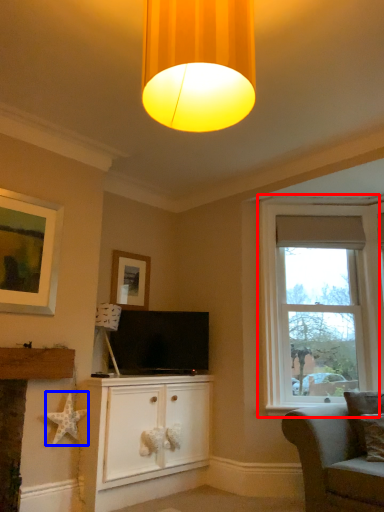
Question: Which object is closer to the camera taking this photo, window (highlighted by a red box) or star (highlighted by a blue box)?

Choices:
 (A) window
 (B) star

Answer: (B)